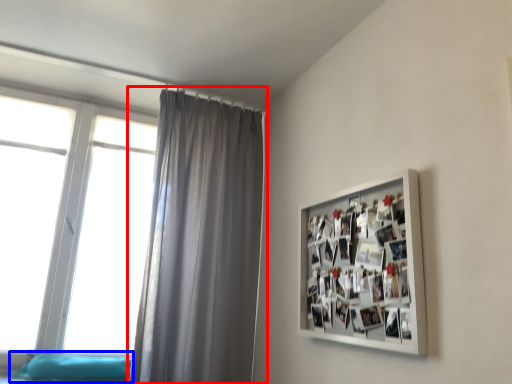
Question: Which object is closer to the camera taking this photo, curtain (highlighted by a red box) or bed frame (highlighted by a blue box)?

Choices:
 (A) curtain
 (B) bed frame

Answer: (A)